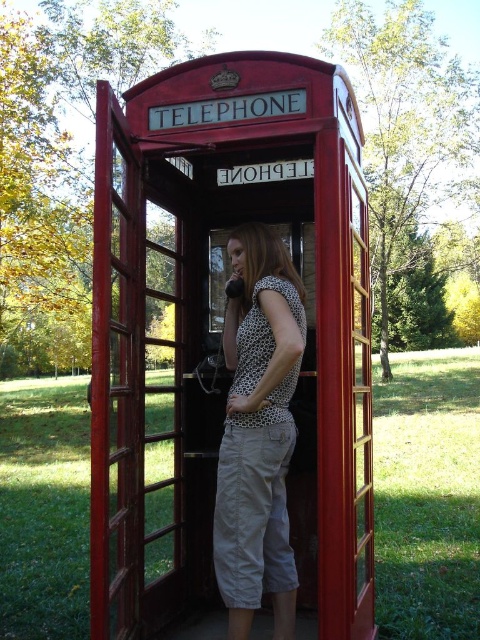
Question: Does matte red telephone booth at center have a greater width compared to polka dot fabric shirt at center?

Choices:
 (A) yes
 (B) no

Answer: (A)

Question: Among these objects, which one is nearest to the camera?

Choices:
 (A) polka dot fabric shirt at center
 (B) matte red telephone booth at center

Answer: (B)

Question: Which of the following is the closest to the observer?

Choices:
 (A) polka dot fabric shirt at center
 (B) matte red telephone booth at center

Answer: (B)

Question: Which point is farther to the camera?

Choices:
 (A) matte red telephone booth at center
 (B) polka dot fabric shirt at center

Answer: (B)

Question: Can you confirm if matte red telephone booth at center is smaller than polka dot fabric shirt at center?

Choices:
 (A) no
 (B) yes

Answer: (A)

Question: Is matte red telephone booth at center positioned before polka dot fabric shirt at center?

Choices:
 (A) yes
 (B) no

Answer: (A)